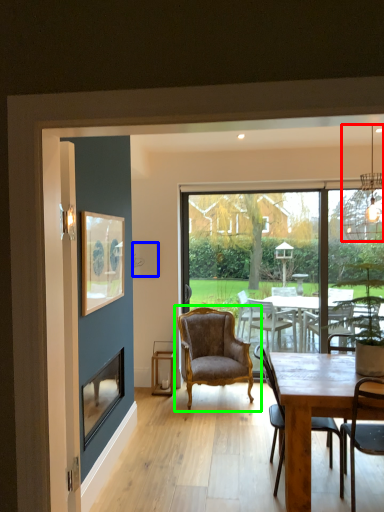
Question: Based on their relative distances, which object is nearer to lamp (highlighted by a red box)? Choose from picture frame (highlighted by a blue box) and chair (highlighted by a green box).

Choices:
 (A) picture frame
 (B) chair

Answer: (B)